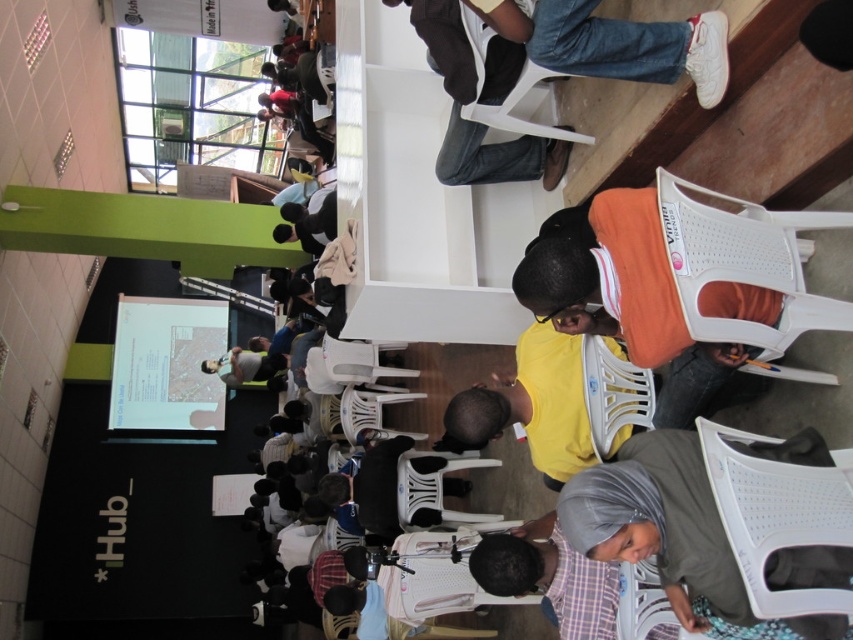
In the scene shown: Can you confirm if white mesh chair at lower right is wider than white plastic chair at upper center?

Incorrect, white mesh chair at lower right's width does not surpass white plastic chair at upper center's.

Between white mesh chair at lower right and white plastic chair at upper center, which one is positioned higher?

white plastic chair at upper center

This screenshot has width=853, height=640. What do you see at coordinates (776, 515) in the screenshot?
I see `white mesh chair at lower right` at bounding box center [776, 515].

Locate an element on the screen. The width and height of the screenshot is (853, 640). white mesh chair at lower right is located at coordinates (776, 515).

Which of these two, white plastic chair at lower right or white plastic chair at upper center, stands shorter?

white plastic chair at upper center

Does point (764, 241) come behind point (468, 38)?

No, (764, 241) is closer to viewer.

Identify the location of white plastic chair at lower right. The width and height of the screenshot is (853, 640). (744, 260).

Which is more to the right, white plastic chair at lower right or white plastic chair at center?

white plastic chair at lower right is more to the right.

Does white plastic chair at lower right have a larger size compared to white plastic chair at center?

Yes, white plastic chair at lower right is bigger than white plastic chair at center.

Describe the element at coordinates (744, 260) in the screenshot. The height and width of the screenshot is (640, 853). I see `white plastic chair at lower right` at that location.

I want to click on white plastic chair at lower right, so click(744, 260).